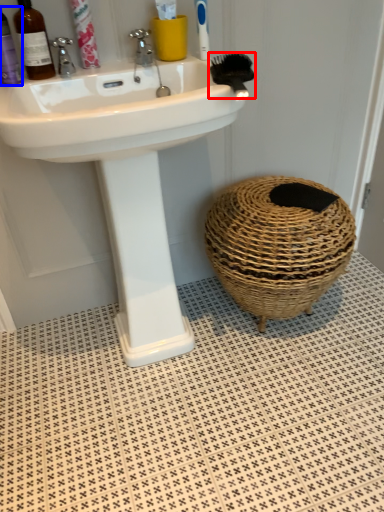
Question: Which object is closer to the camera taking this photo, brush (highlighted by a red box) or mouthwash (highlighted by a blue box)?

Choices:
 (A) brush
 (B) mouthwash

Answer: (A)